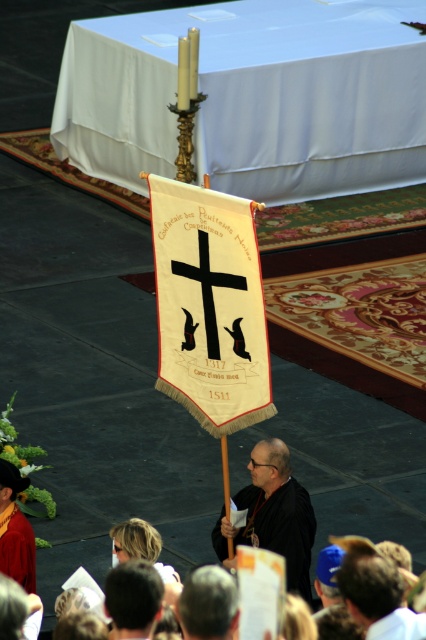
Is gray hair at lower center to the right of maroon velvet robe at lower left from the viewer's perspective?

Yes, gray hair at lower center is to the right of maroon velvet robe at lower left.

Does gray hair at lower center have a greater height compared to maroon velvet robe at lower left?

No.

Describe the element at coordinates (209, 604) in the screenshot. I see `gray hair at lower center` at that location.

Image resolution: width=426 pixels, height=640 pixels. In order to click on gray hair at lower center in this screenshot , I will do `click(209, 604)`.

Can you confirm if gold textured banner at center is shorter than dark brown leather hat at lower right?

Incorrect, gold textured banner at center's height does not fall short of dark brown leather hat at lower right's.

Who is more forward, (215, 358) or (391, 636)?

Point (391, 636) is in front.

What do you see at coordinates (210, 305) in the screenshot? I see `gold textured banner at center` at bounding box center [210, 305].

At what (x,y) coordinates should I click in order to perform the action: click on gold textured banner at center. Please return your answer as a coordinate pair (x, y). The height and width of the screenshot is (640, 426). Looking at the image, I should click on (210, 305).

Describe the element at coordinates (281, 529) in the screenshot. I see `black matte robe at center` at that location.

Does black matte robe at center appear on the right side of maroon velvet robe at lower left?

Indeed, black matte robe at center is positioned on the right side of maroon velvet robe at lower left.

This screenshot has height=640, width=426. What are the coordinates of `black matte robe at center` in the screenshot? It's located at (281, 529).